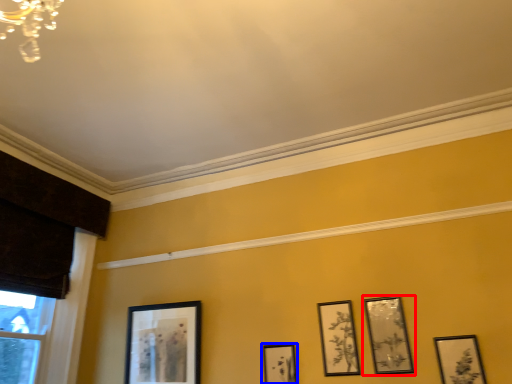
Question: Which object is closer to the camera taking this photo, picture frame (highlighted by a red box) or picture frame (highlighted by a blue box)?

Choices:
 (A) picture frame
 (B) picture frame

Answer: (A)